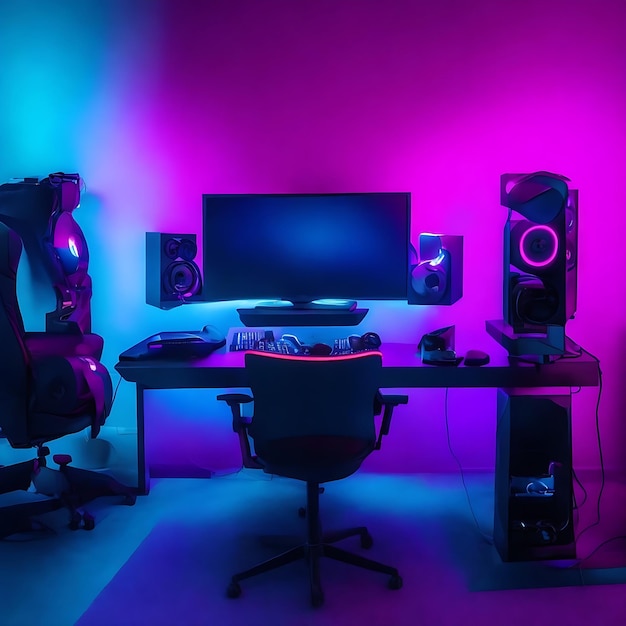
Locate an element on the screen. This screenshot has width=626, height=626. computer chair wheels is located at coordinates (78, 526), (89, 526), (133, 500), (317, 607), (237, 593), (396, 588), (370, 546), (265, 548).